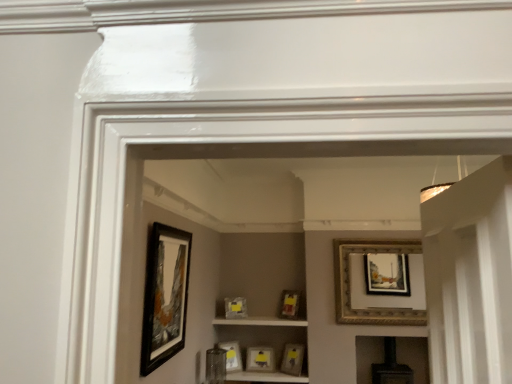
Question: From a real-world perspective, does matte yellow picture frame at center, the fifth picture frame from the back, sit lower than matte gold picture frame at center, the 5th picture frame when ordered from left to right?

Choices:
 (A) yes
 (B) no

Answer: (A)

Question: From a real-world perspective, is matte yellow picture frame at center, the fifth picture frame from the back, on matte gold picture frame at center, the 5th picture frame when ordered from left to right?

Choices:
 (A) no
 (B) yes

Answer: (A)

Question: Is matte yellow picture frame at center, positioned as the second picture frame in right-to-left order, surrounding matte gold picture frame at center, arranged as the 5th picture frame when viewed from the front?

Choices:
 (A) yes
 (B) no

Answer: (B)

Question: Are matte yellow picture frame at center, the fifth picture frame from the back, and matte gold picture frame at center, which is the third picture frame in back-to-front order, located far from each other?

Choices:
 (A) yes
 (B) no

Answer: (B)

Question: Is matte yellow picture frame at center, positioned as the second picture frame in right-to-left order, positioned behind matte gold picture frame at center, the third picture frame in the right-to-left sequence?

Choices:
 (A) yes
 (B) no

Answer: (B)

Question: In the image, is gold ornate picture frame at upper right, which is the 2th picture frame from front to back, positioned in front of or behind black matte picture frame at left, which is counted as the 1th picture frame, starting from the front?

Choices:
 (A) front
 (B) behind

Answer: (B)

Question: Considering the positions of gold ornate picture frame at upper right, which is the 6th picture frame in back-to-front order, and black matte picture frame at left, the seventh picture frame from the back, in the image, is gold ornate picture frame at upper right, which is the 6th picture frame in back-to-front order, taller or shorter than black matte picture frame at left, the seventh picture frame from the back,?

Choices:
 (A) short
 (B) tall

Answer: (A)

Question: Based on their positions, is gold ornate picture frame at upper right, the 7th picture frame from the left, located to the left or right of black matte picture frame at left, which is counted as the 1th picture frame, starting from the front?

Choices:
 (A) right
 (B) left

Answer: (A)

Question: In terms of size, does gold ornate picture frame at upper right, which is the 2th picture frame from front to back, appear bigger or smaller than black matte picture frame at left, the seventh picture frame from the back?

Choices:
 (A) small
 (B) big

Answer: (B)

Question: In terms of height, does matte yellow picture frame at center, positioned as the second picture frame in right-to-left order, look taller or shorter compared to gold ornate picture frame at upper right, the 7th picture frame from the left?

Choices:
 (A) tall
 (B) short

Answer: (B)

Question: From the image's perspective, is matte yellow picture frame at center, the 3th picture frame positioned from the front, above or below gold ornate picture frame at upper right, placed as the first picture frame when sorted from right to left?

Choices:
 (A) below
 (B) above

Answer: (A)

Question: Relative to gold ornate picture frame at upper right, the 7th picture frame from the left, is matte yellow picture frame at center, the sixth picture frame in the left-to-right sequence, in front or behind?

Choices:
 (A) behind
 (B) front

Answer: (A)

Question: Looking at the image, does matte yellow picture frame at center, the sixth picture frame in the left-to-right sequence, seem bigger or smaller compared to gold ornate picture frame at upper right, which is the 2th picture frame from front to back?

Choices:
 (A) big
 (B) small

Answer: (B)

Question: Is point (291, 304) closer or farther from the camera than point (270, 369)?

Choices:
 (A) closer
 (B) farther

Answer: (B)

Question: In terms of width, does matte gold picture frame at center, the 5th picture frame when ordered from left to right, look wider or thinner when compared to matte black picture frame at center, placed as the second picture frame when sorted from back to front?

Choices:
 (A) thin
 (B) wide

Answer: (A)